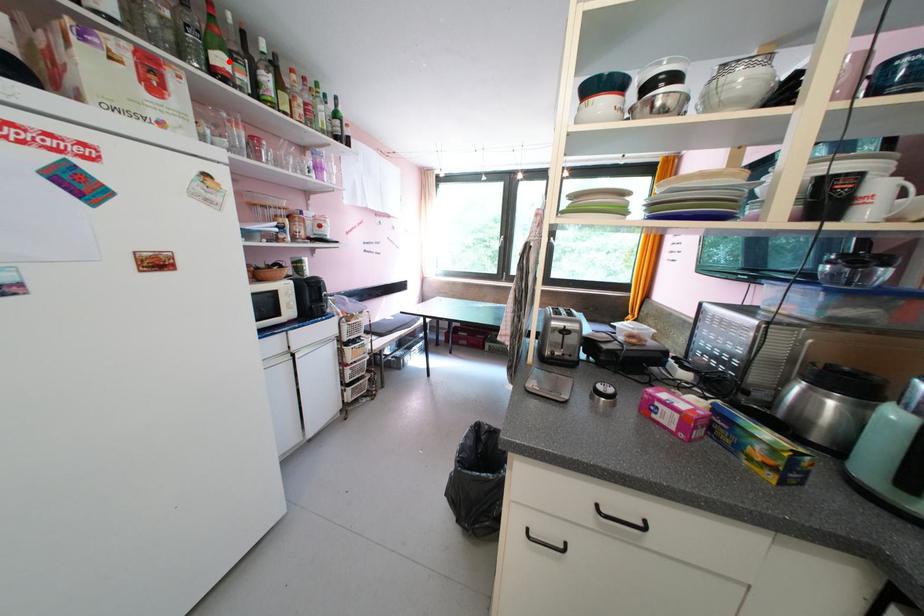
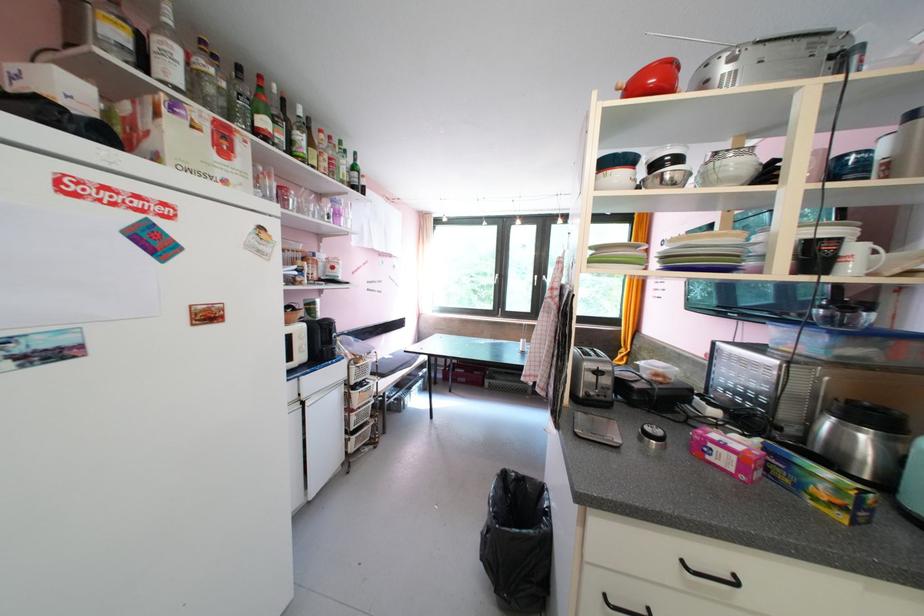
Where in the second image is the point corresponding to the highlighted location from the first image?

(273, 124)